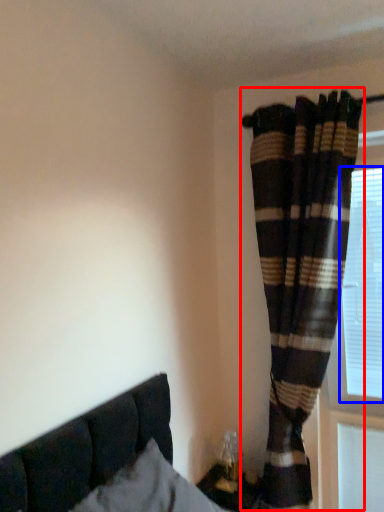
Question: Among these objects, which one is nearest to the camera, curtain (highlighted by a red box) or bay window (highlighted by a blue box)?

Choices:
 (A) curtain
 (B) bay window

Answer: (A)